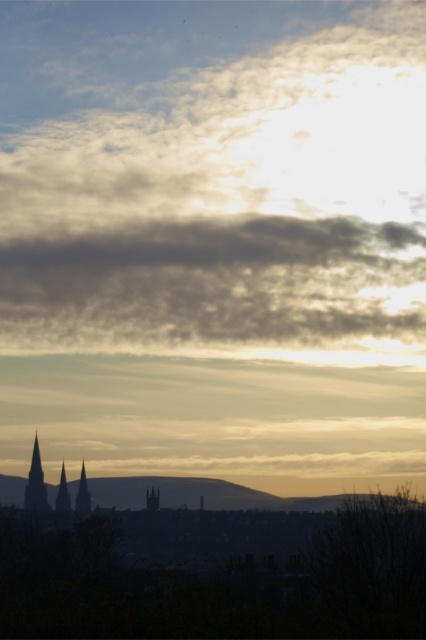
In the scene shown: You are an architect analyzing the cityscape in the image. You notice the dark gray stone tower at lower left and the smooth stone spire at center. Which of these two structures is positioned higher in the scene?

The dark gray stone tower at lower left is positioned higher in the scene than the smooth stone spire at center.

You are a drone operator who needs to fly a drone from the dark gray stone tower at lower left to the smooth stone spire at center. The drone has a maximum flight range of 15 meters. Can you safely complete the flight without exceeding the range?

The distance between the dark gray stone tower at lower left and the smooth stone spire at center is 18.04 meters, which exceeds the drone maximum flight range of 15 meters. Therefore, the drone cannot safely complete the flight without exceeding the range.